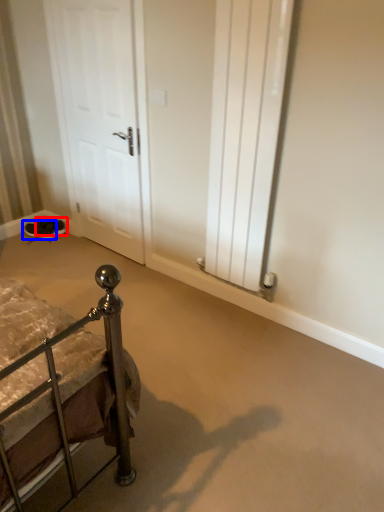
Question: Which of the following is the farthest to the observer, footwear (highlighted by a red box) or footwear (highlighted by a blue box)?

Choices:
 (A) footwear
 (B) footwear

Answer: (A)